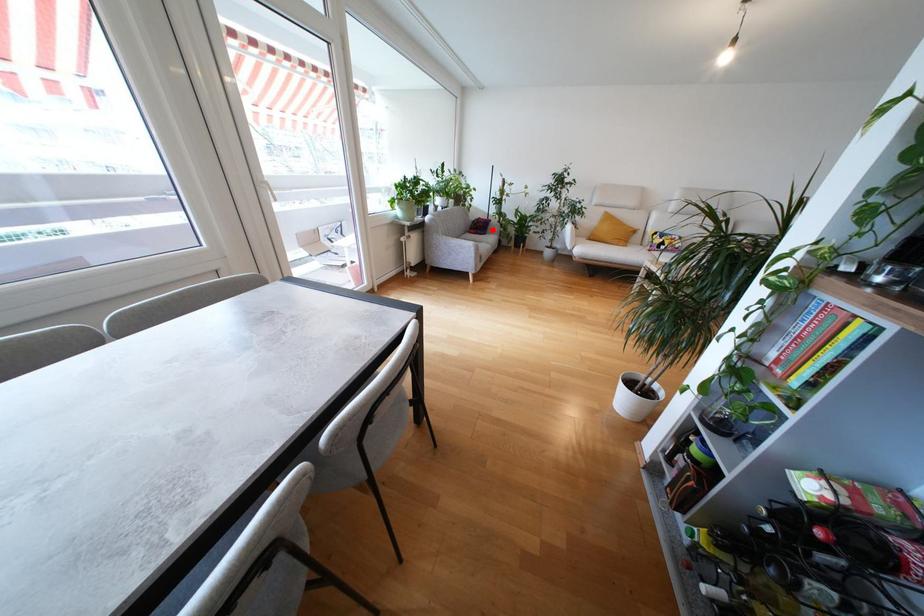
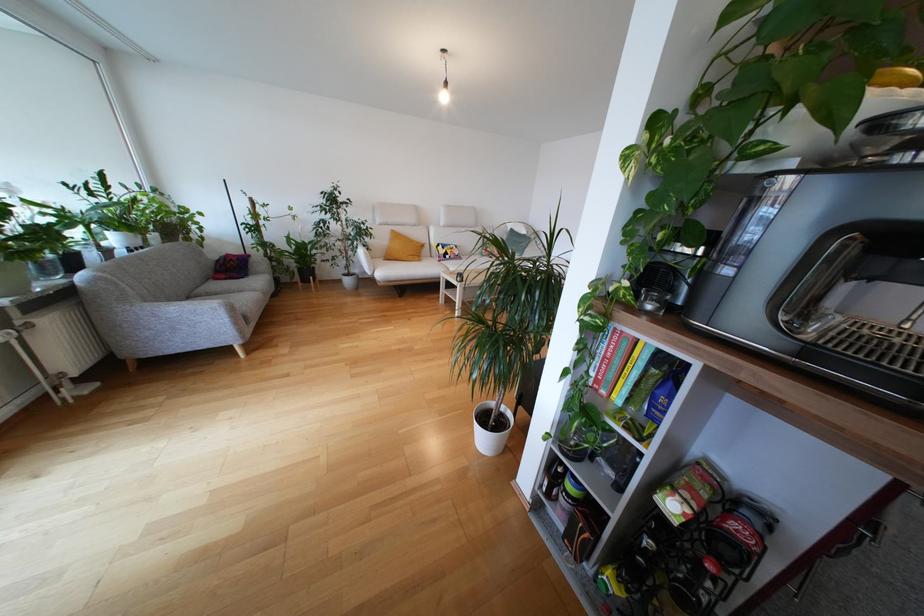
The point at the highlighted location is marked in the first image. Where is the corresponding point in the second image?

(253, 268)